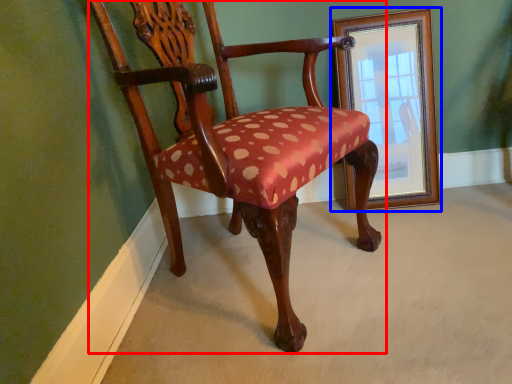
Question: Which object appears farthest to the camera in this image, chair (highlighted by a red box) or picture frame (highlighted by a blue box)?

Choices:
 (A) chair
 (B) picture frame

Answer: (B)